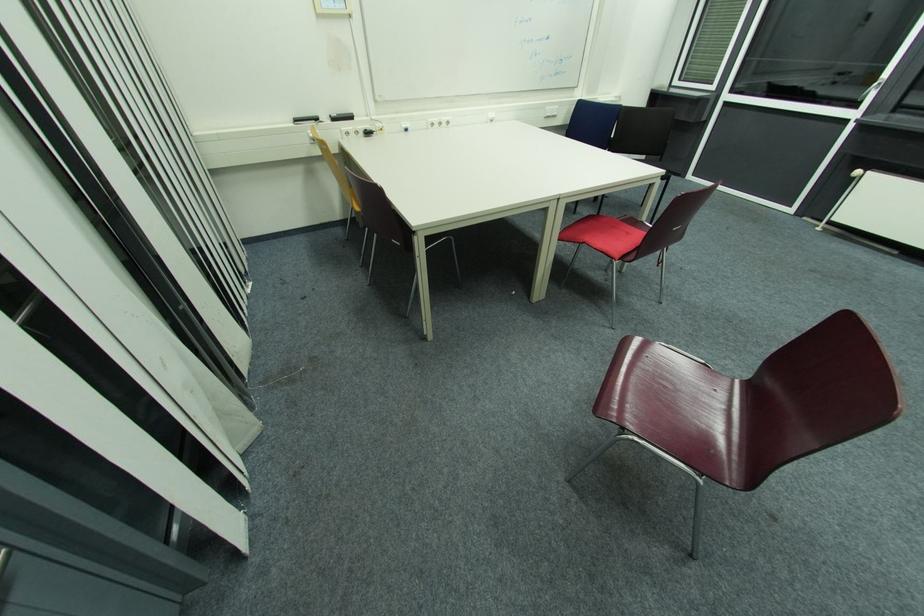
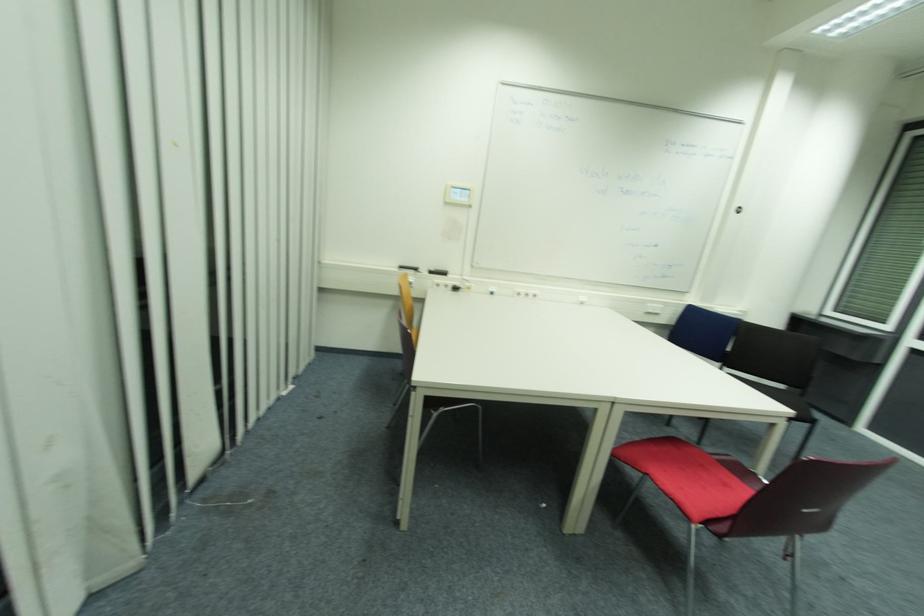
Question: I am providing you with two images of the same scene from different viewpoints. Which of the following objects are not visible in image2?

Choices:
 (A) black whiteboard eraser
 (B) red chair sitting surface
 (C) white power outlet
 (D) none of these

Answer: (D)